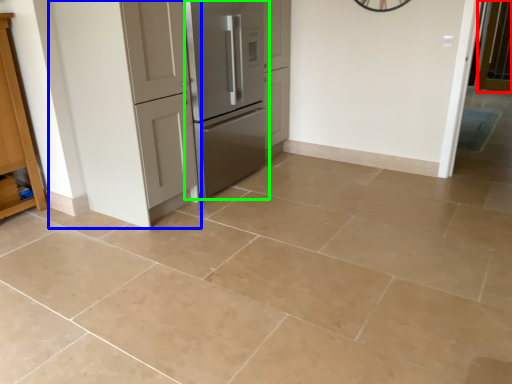
Question: Estimate the real-world distances between objects in this image. Which object is closer to screen door (highlighted by a red box), door (highlighted by a blue box) or refrigerator (highlighted by a green box)?

Choices:
 (A) door
 (B) refrigerator

Answer: (B)